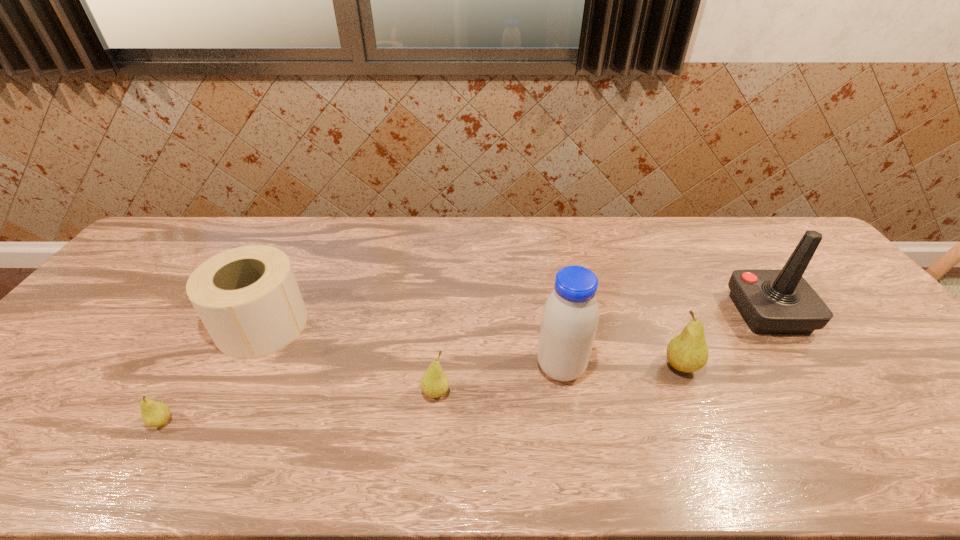
Find the location of `vacant region located on the right of the second tallest pear`. vacant region located on the right of the second tallest pear is located at coordinates (618, 393).

I want to click on vacant region located 0.120m on the left of the fifth object from left to right, so tap(614, 367).

Image resolution: width=960 pixels, height=540 pixels. Identify the location of vacant region located on the left of the toilet tissue. (78, 325).

Locate an element on the screen. vacant space located on the back of the joystick is located at coordinates (703, 218).

Where is `vacant space situated 0.070m on the left of the third object from right to left`? This screenshot has width=960, height=540. vacant space situated 0.070m on the left of the third object from right to left is located at coordinates (508, 367).

Locate an element on the screen. This screenshot has width=960, height=540. free space at the far edge of the desktop is located at coordinates (420, 217).

At what (x,y) coordinates should I click in order to perform the action: click on vacant space at the left edge. Please return your answer as a coordinate pair (x, y). Image resolution: width=960 pixels, height=540 pixels. Looking at the image, I should click on click(68, 381).

You are a GUI agent. You are given a task and a screenshot of the screen. Output one action in this format:
    pyautogui.click(x=<x>, y=<y>)
    Task: Click on the blank space at the right edge
    
    Given the screenshot: What is the action you would take?
    pyautogui.click(x=861, y=366)

Where is `empty space that is in between the fourth object from left to right and the tallest pear`? The height and width of the screenshot is (540, 960). empty space that is in between the fourth object from left to right and the tallest pear is located at coordinates (621, 367).

Where is `vacant space that is in between the leftmost pear and the rightmost pear`? This screenshot has width=960, height=540. vacant space that is in between the leftmost pear and the rightmost pear is located at coordinates (421, 394).